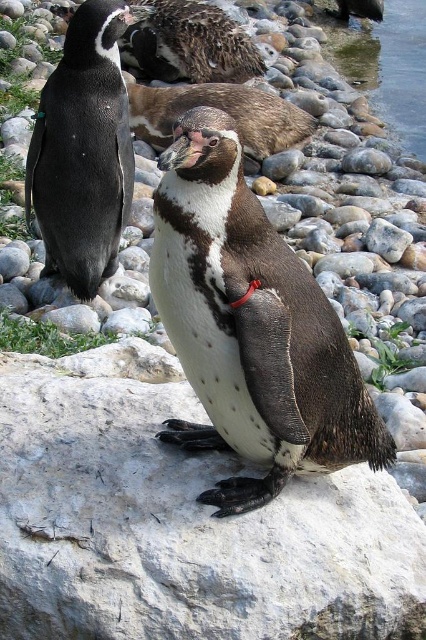
In the scene shown: You are a wildlife photographer trying to capture a closeup of the white speckled feathers at center and the black glossy penguin at left. Since you want to focus on the smaller subject first, which one should you adjust your camera settings for?

The white speckled feathers at center is smaller than the black glossy penguin at left, so you should adjust your camera settings for the white speckled feathers at center first.

Looking at this image, you are a penguin swimming in the clear water at right and want to reach the speckled brown penguin at center. Considering the width of the water and the penguin, which direction should you swim to get closer?

The clear water at right is wider than the speckled brown penguin at center, so you should swim towards the left to get closer.

You are a wildlife photographer aiming to capture a closeup of the white speckled feathers at center and the black glossy penguin at left. Since you want both subjects in focus, you need to know which one is shorter. Which penguin is shorter?

The white speckled feathers at center is shorter than the black glossy penguin at left.